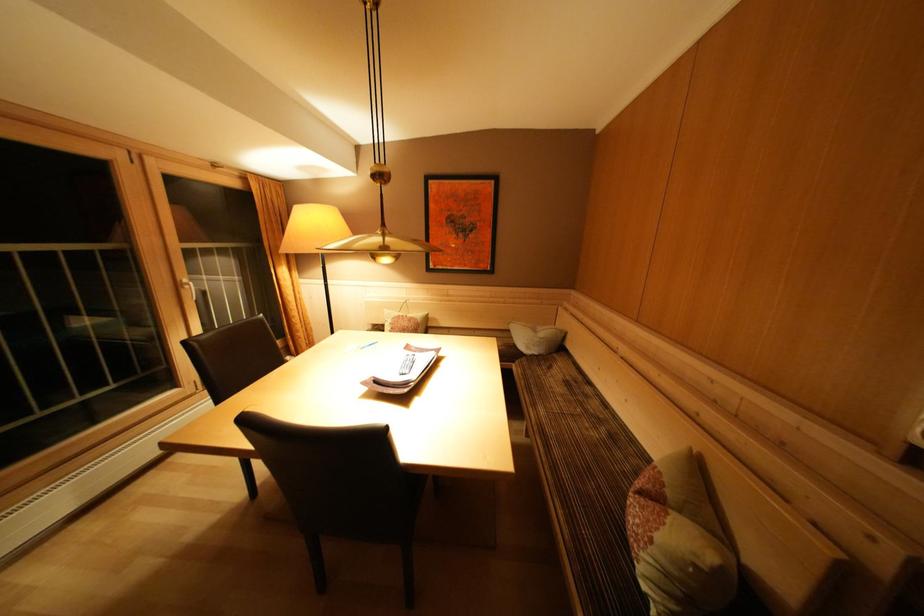
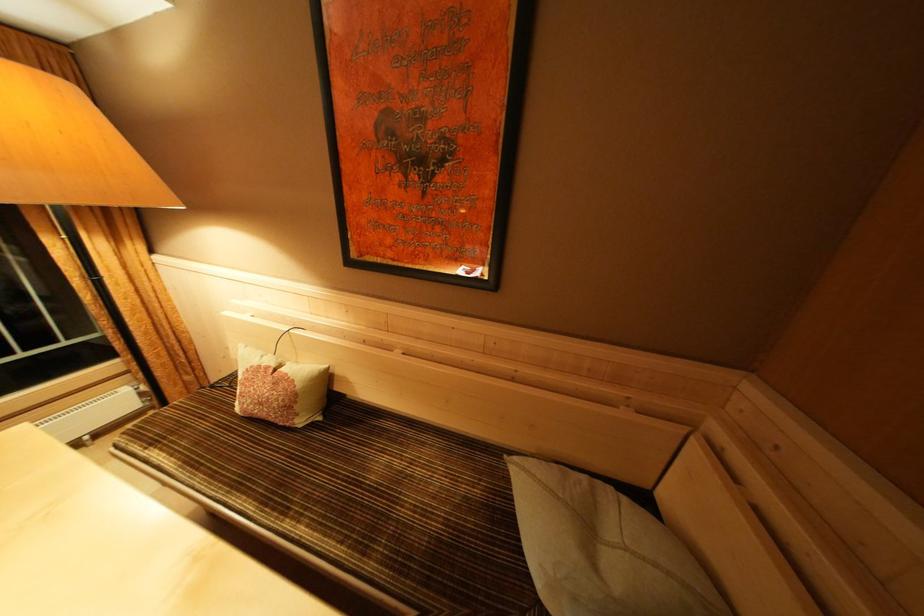
Question: Which direction would the cameraman need to move to produce the second image? Reply with the corresponding letter.

Choices:
 (A) Left
 (B) Right
 (C) Forward
 (D) Backward

Answer: (C)